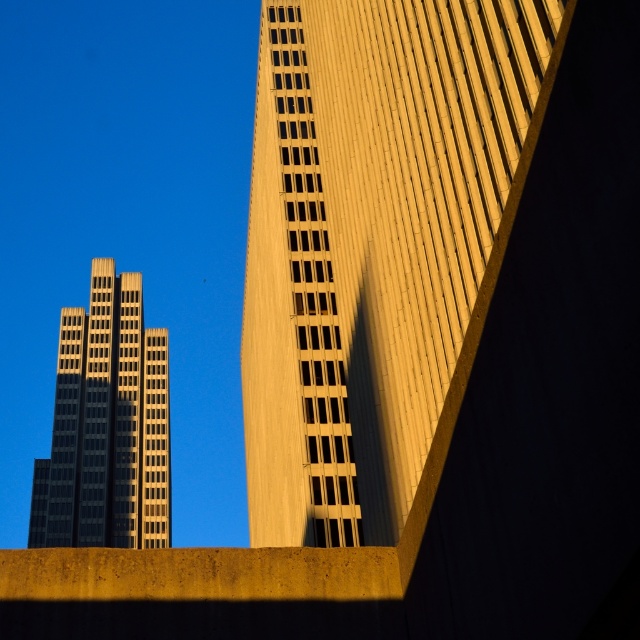
You are a drone operator who needs to deliver a package to the golden concrete building at upper right. According to the coordinates provided, where should you aim the drone to ensure it reaches the correct location?

The golden concrete building at upper right is located at point (374, 243), so you should aim the drone at those coordinates to deliver the package accurately.

You are standing in the city square and want to take a photo of the golden concrete building at upper right. If your camera can focus on objects up to 30 feet away, will you need to move closer to capture it clearly?

The golden concrete building at upper right is 31.83 feet away from the viewer, which is beyond the camera focus range of 30 feet. Therefore, you need to move closer to ensure it is in focus.

You are a drone operator tasked with flying a drone between the golden concrete building at upper right and the matte gold skyscraper at left. The drone has a maximum flight range of 250 feet. Can the drone safely make this flight without exceeding its range?

The distance between the golden concrete building at upper right and the matte gold skyscraper at left is 271.14 feet, which exceeds the drone operator has a maximum flight range of 250 feet. Therefore, the drone cannot safely make this flight without exceeding its range.